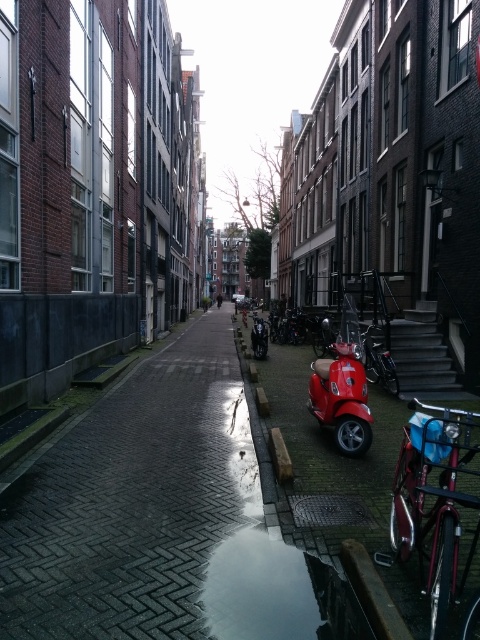
You are a delivery person trying to avoid getting your shoes wet. You see a transparent glass puddle at lower center and a shiny black motorcycle at center. Which object should you step around to keep your shoes dry?

The transparent glass puddle at lower center is smaller than the shiny black motorcycle at center, so stepping around the transparent glass puddle at lower center would be better to avoid getting your shoes wet since it is the smaller obstacle.

You are a delivery person needing to park your bike in this narrow street. You see a shiny red bicycle at lower right and a shiny black bicycle at center. Which bicycle has more space between its handlebars and seat, allowing for easier maneuvering around it?

The shiny red bicycle at lower right has a larger width than the shiny black bicycle at center, meaning it has more space between its handlebars and seat. This makes it easier to maneuver around the shiny red bicycle at lower right.

You are a delivery person trying to cross the street to deliver a package. There is a transparent glass puddle at lower center and a shiny black motorcycle at center. How far apart are these two objects from each other?

The transparent glass puddle at lower center and shiny black motorcycle at center are 11.19 meters apart.